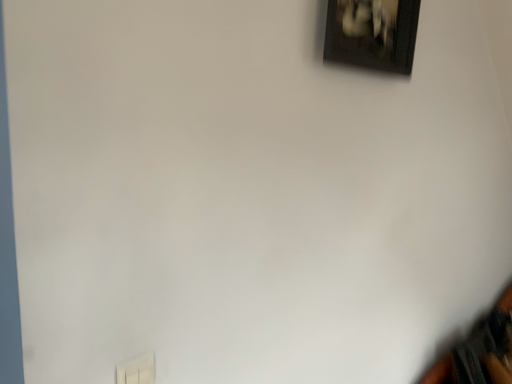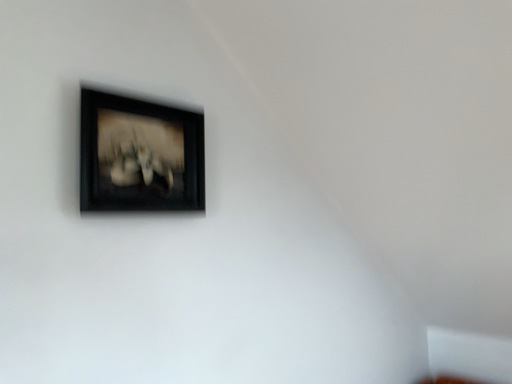
Question: Which way did the camera rotate in the video?

Choices:
 (A) rotated upward
 (B) rotated downward

Answer: (A)